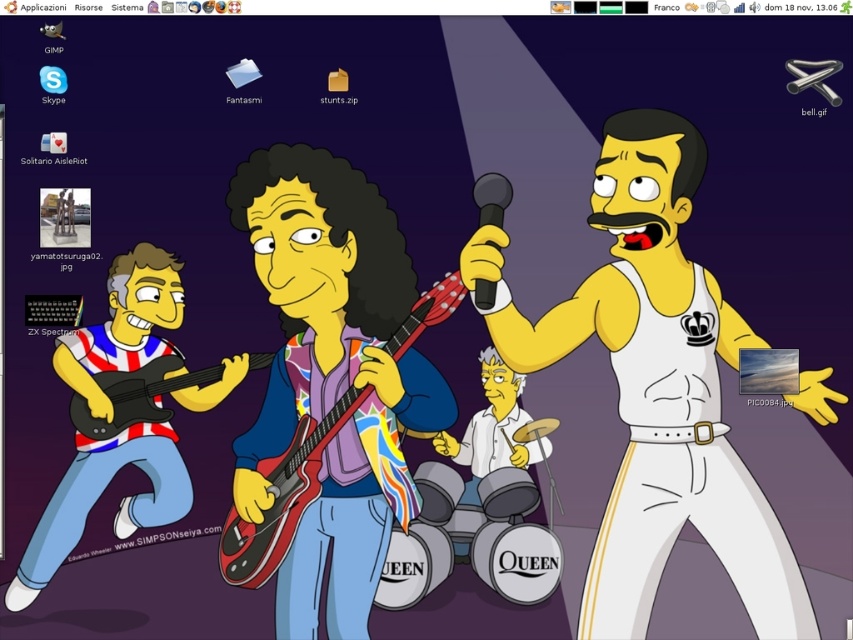
Question: Which point is closer to the camera?

Choices:
 (A) (631, 609)
 (B) (260, 355)
 (C) (440, 448)

Answer: (A)

Question: Can you confirm if striped fabric guitar at left is wider than white matte drum set at center?

Choices:
 (A) yes
 (B) no

Answer: (A)

Question: Among these objects, which one is nearest to the camera?

Choices:
 (A) shiny metallic guitar at center
 (B) brushed metal guitar at left
 (C) striped fabric guitar at left

Answer: (A)

Question: Considering the real-world distances, which object is farthest from the brushed metal guitar at left?

Choices:
 (A) striped fabric guitar at left
 (B) white glossy tank top at center

Answer: (B)

Question: Can you confirm if white glossy tank top at center is positioned to the right of striped fabric guitar at left?

Choices:
 (A) yes
 (B) no

Answer: (A)

Question: From the image, what is the correct spatial relationship of white glossy tank top at center in relation to white matte drum set at center?

Choices:
 (A) right
 (B) left

Answer: (A)